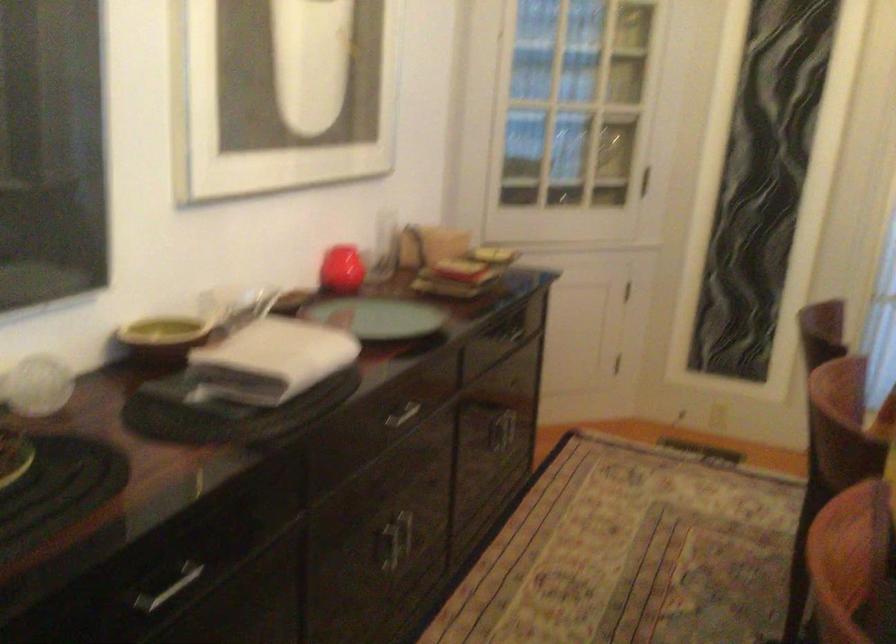
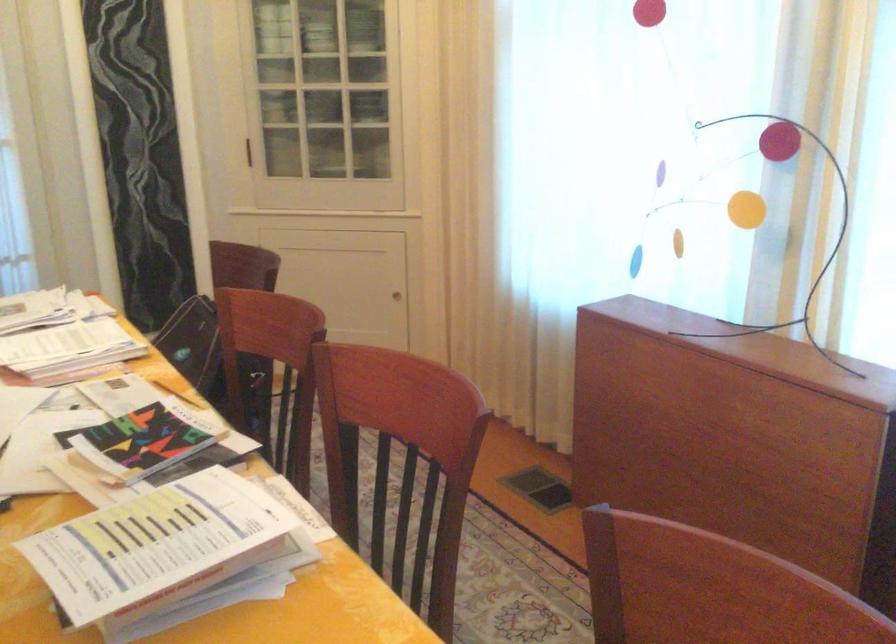
Question: The camera is either moving clockwise (left) or counter-clockwise (right) around the object. The first image is from the beginning of the video and the second image is from the end. Is the camera moving left or right when shooting the video?

Choices:
 (A) Left
 (B) Right

Answer: (A)